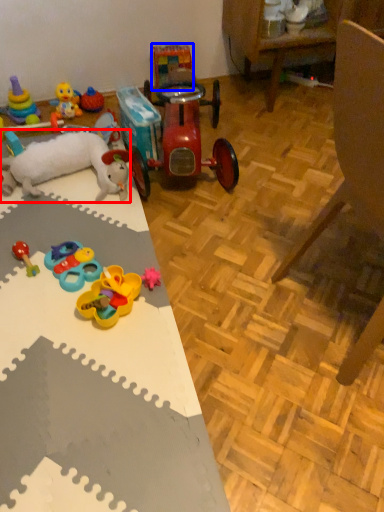
Question: Which point is further to the camera, toy (highlighted by a red box) or toy (highlighted by a blue box)?

Choices:
 (A) toy
 (B) toy

Answer: (B)